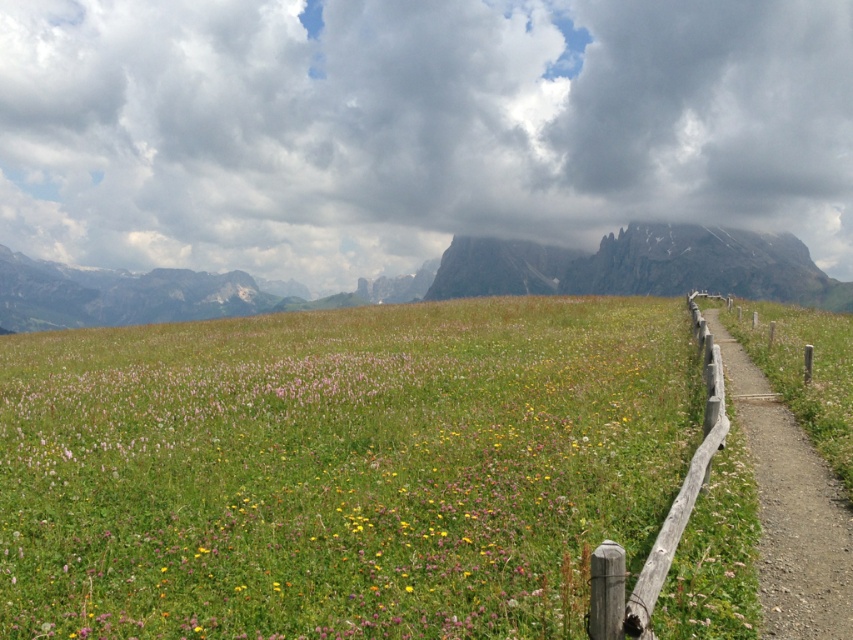
Between green grassy field at center and wooden fence at right, which one has less height?

wooden fence at right is shorter.

Does green grassy field at center appear on the left side of wooden fence at right?

Yes, green grassy field at center is to the left of wooden fence at right.

Locate an element on the screen. green grassy field at center is located at coordinates (338, 468).